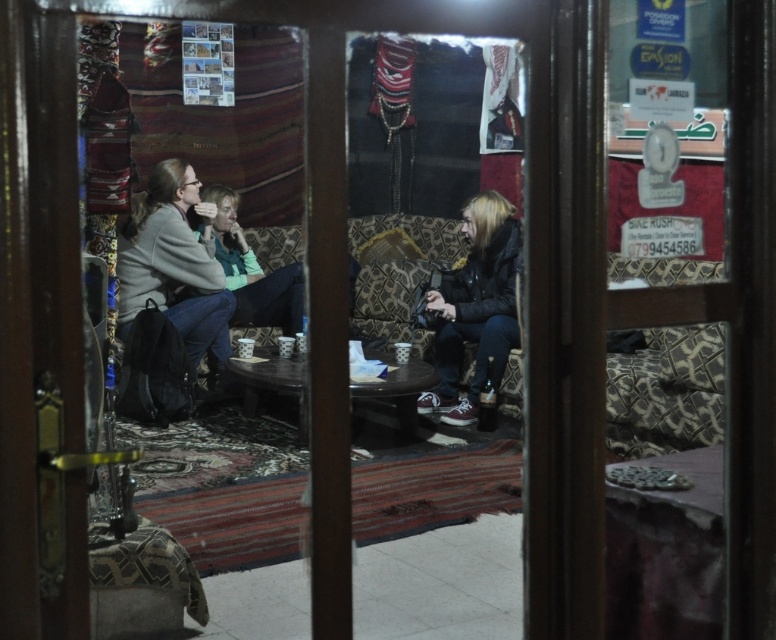
Does light gray sweater at left have a smaller size compared to dark gray leather jacket at center?

No, light gray sweater at left is not smaller than dark gray leather jacket at center.

Is the position of light gray sweater at left more distant than that of dark gray leather jacket at center?

No, light gray sweater at left is in front of dark gray leather jacket at center.

Find the location of a particular element. The image size is (776, 640). light gray sweater at left is located at coordinates (175, 266).